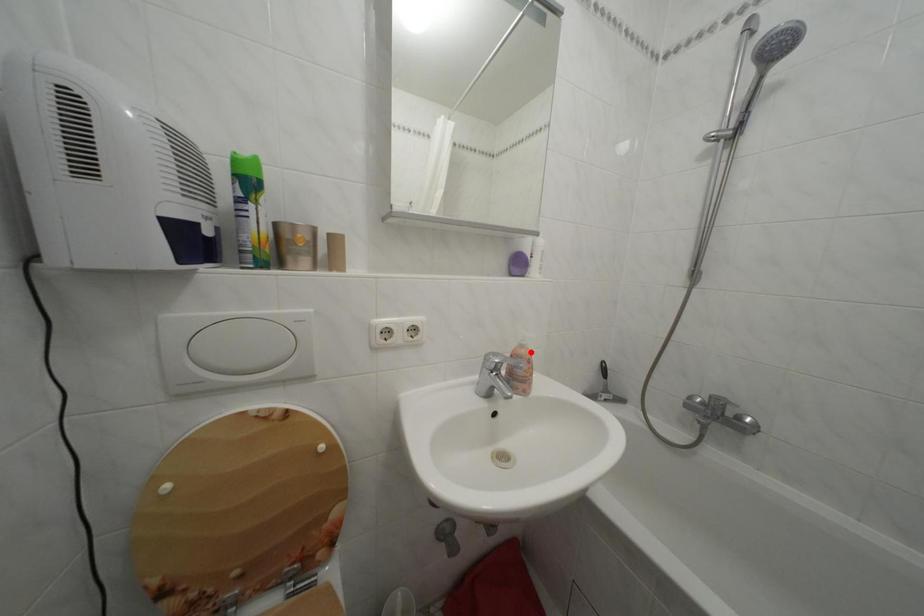
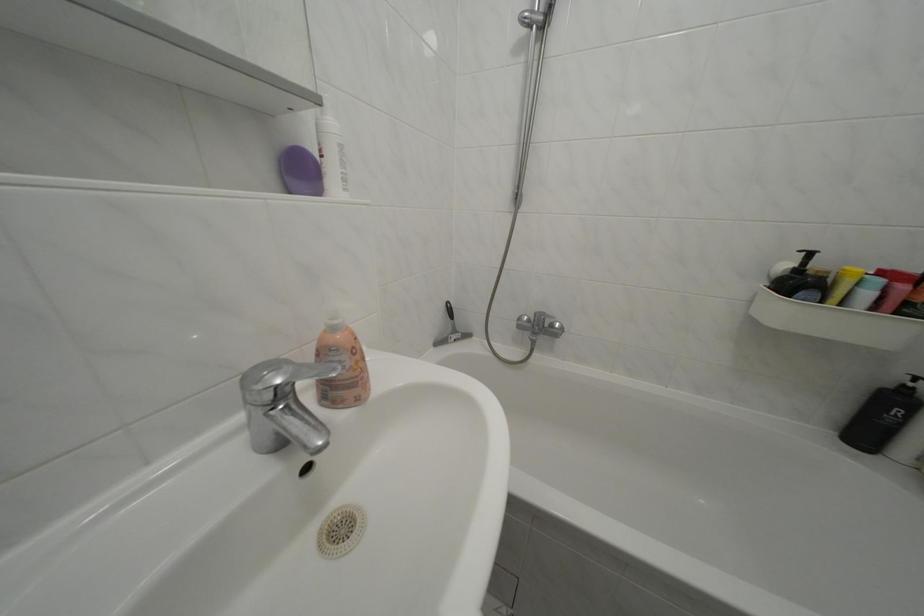
Where in the second image is the point corresponding to the highlighted location from the first image?

(342, 334)